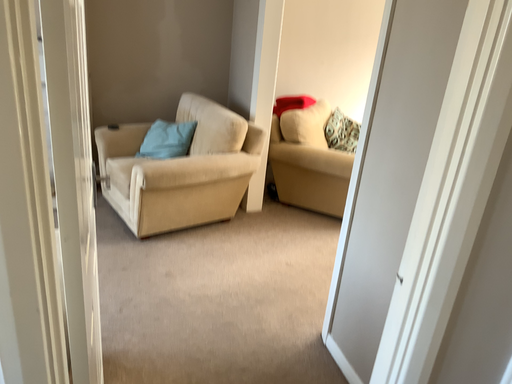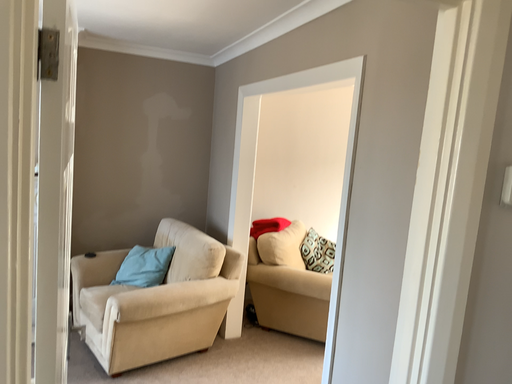
Question: Which way did the camera rotate in the video?

Choices:
 (A) rotated downward
 (B) rotated upward

Answer: (B)